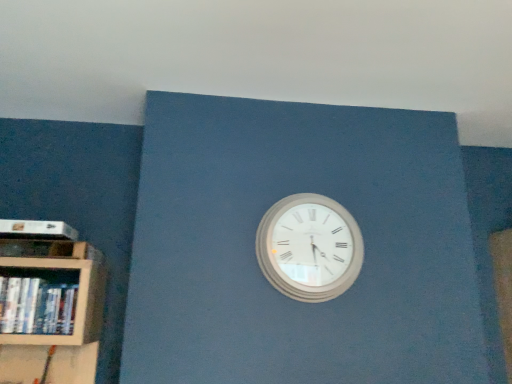
Question: In the image, is white glossy book at left positioned in front of or behind white matte paperback book at left?

Choices:
 (A) front
 (B) behind

Answer: (A)

Question: Is white glossy book at left wider or thinner than white matte paperback book at left?

Choices:
 (A) thin
 (B) wide

Answer: (A)

Question: Which is nearer to the white matte paperback book at left?

Choices:
 (A) white glossy book at left
 (B) white wooden wall clock at center

Answer: (A)

Question: Which of these objects is positioned farthest from the white matte paperback book at left?

Choices:
 (A) white glossy book at left
 (B) white wooden wall clock at center

Answer: (B)